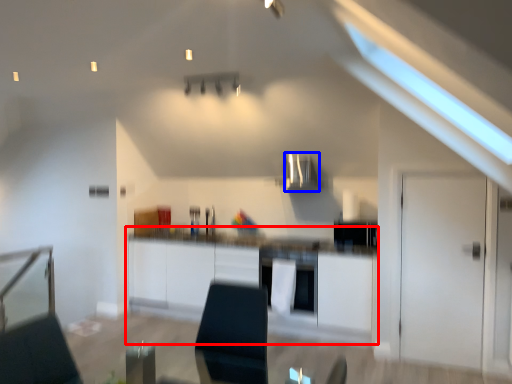
Question: Which object appears farthest to the camera in this image, cabinetry (highlighted by a red box) or exhaust hood (highlighted by a blue box)?

Choices:
 (A) cabinetry
 (B) exhaust hood

Answer: (B)